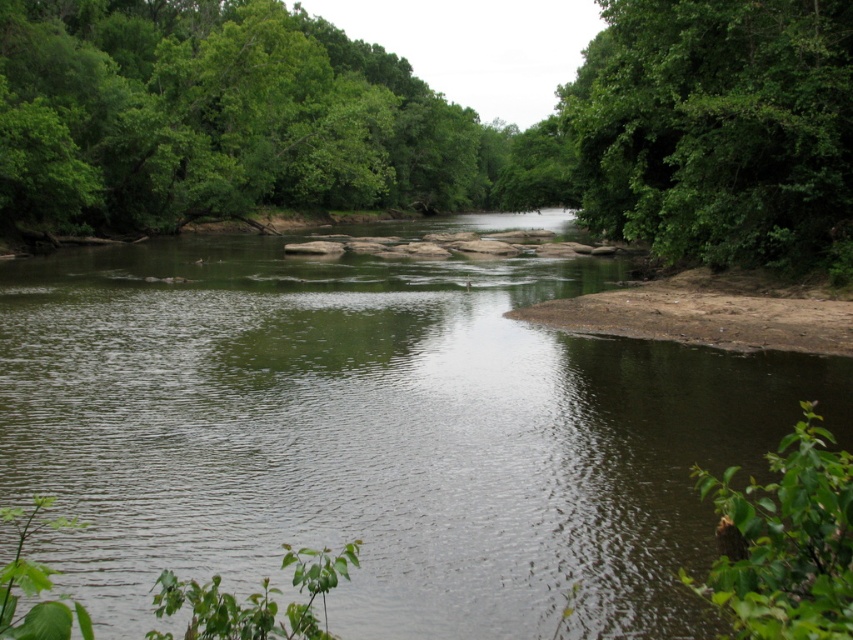
You are a bird seeking a nesting spot. You see the green leafy tree at center and the green leafy tree at upper right. Which tree has a wider canopy for nesting?

The green leafy tree at center might be wider than green leafy tree at upper right, so it has a wider canopy for nesting.

You are a kayaker planning to navigate through the river. You see the green smooth water at center and the green leafy tree at center. Which one is narrower in width?

The green smooth water at center is thinner than the green leafy tree at center, so the green smooth water at center is narrower in width.

You are an environmental scientist assessing the health of the river ecosystem. You observe the green leafy tree at center and the green leafy tree at upper right. Which tree could potentially provide more shade to the river, and why?

The green leafy tree at center is bigger than the green leafy tree at upper right, so it can provide more shade to the river because larger trees typically have broader canopies that cover more area.